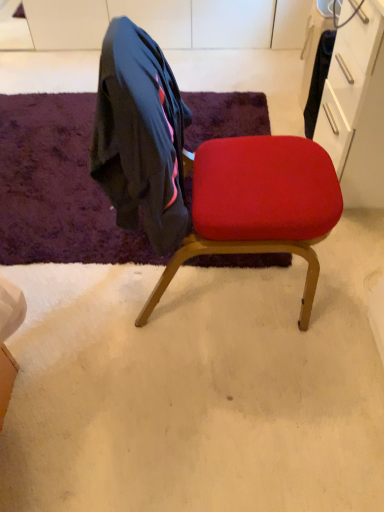
Question: Is purple shaggy rug at upper left far away from velvet red chair at center?

Choices:
 (A) yes
 (B) no

Answer: (B)

Question: From the image's perspective, would you say purple shaggy rug at upper left is shown under velvet red chair at center?

Choices:
 (A) no
 (B) yes

Answer: (A)

Question: Is purple shaggy rug at upper left at the right side of velvet red chair at center?

Choices:
 (A) no
 (B) yes

Answer: (A)

Question: Is purple shaggy rug at upper left thinner than velvet red chair at center?

Choices:
 (A) yes
 (B) no

Answer: (B)

Question: Is purple shaggy rug at upper left turned away from velvet red chair at center?

Choices:
 (A) no
 (B) yes

Answer: (A)

Question: Is purple shaggy rug at upper left further to camera compared to velvet red chair at center?

Choices:
 (A) yes
 (B) no

Answer: (A)

Question: Is there a large distance between velvet red chair at center and purple shaggy rug at upper left?

Choices:
 (A) no
 (B) yes

Answer: (A)

Question: Can you confirm if velvet red chair at center is smaller than purple shaggy rug at upper left?

Choices:
 (A) yes
 (B) no

Answer: (B)

Question: From the image's perspective, would you say velvet red chair at center is shown under purple shaggy rug at upper left?

Choices:
 (A) no
 (B) yes

Answer: (B)

Question: Is velvet red chair at center bigger than purple shaggy rug at upper left?

Choices:
 (A) no
 (B) yes

Answer: (B)

Question: Does velvet red chair at center have a greater width compared to purple shaggy rug at upper left?

Choices:
 (A) no
 (B) yes

Answer: (A)

Question: Is velvet red chair at center facing away from purple shaggy rug at upper left?

Choices:
 (A) no
 (B) yes

Answer: (A)

Question: Relative to velvet red chair at center, is purple shaggy rug at upper left in front or behind?

Choices:
 (A) front
 (B) behind

Answer: (B)